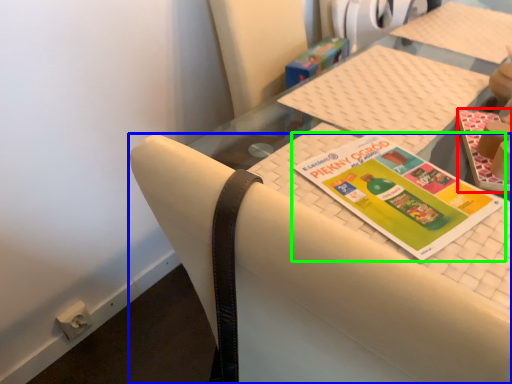
Question: Estimate the real-world distances between objects in this image. Which object is closer to book (highlighted by a red box), chair (highlighted by a blue box) or book (highlighted by a green box)?

Choices:
 (A) chair
 (B) book

Answer: (B)